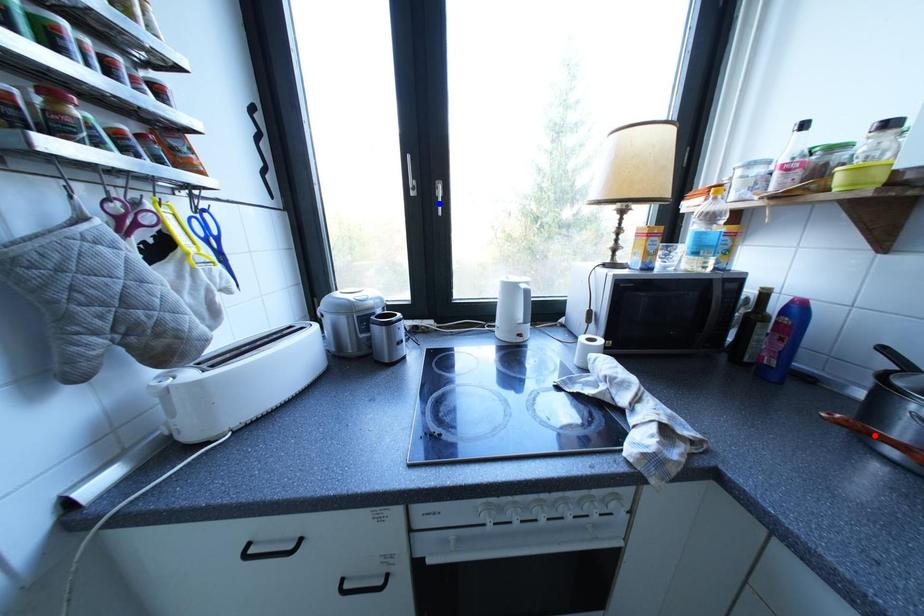
Question: In the image, two points are highlighted. Which point is nearer to the camera? Reply with the corresponding letter.

Choices:
 (A) blue point
 (B) red point

Answer: (B)